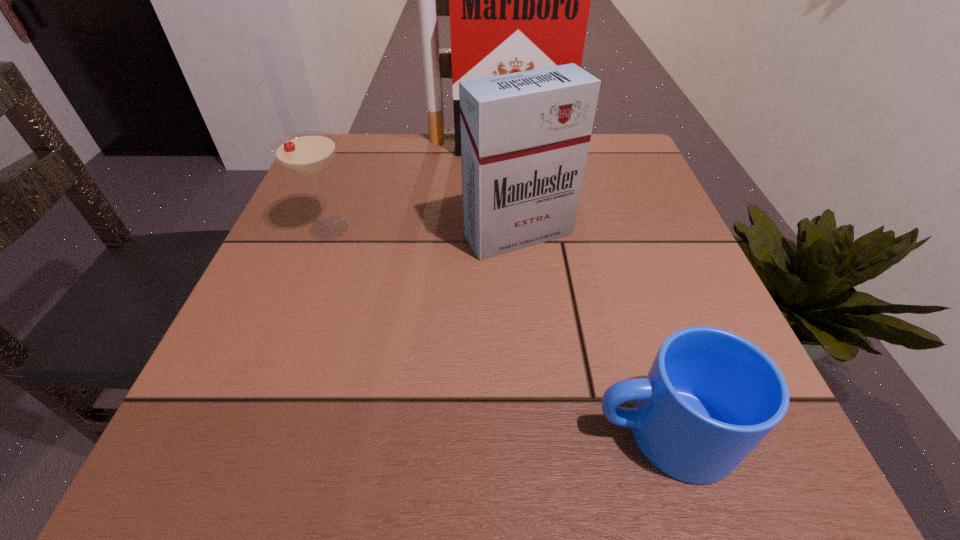
You are a GUI agent. You are given a task and a screenshot of the screen. Output one action in this format:
    pyautogui.click(x=<x>, y=<y>)
    Task: Click on the blank space at the near edge
    The image size is (960, 540).
    Given the screenshot: What is the action you would take?
    pyautogui.click(x=364, y=484)

The image size is (960, 540). Identify the location of vacant region at the left edge of the desktop. (279, 284).

This screenshot has width=960, height=540. I want to click on free space at the right edge of the desktop, so click(666, 225).

Where is `free space at the far left corner of the desktop`? free space at the far left corner of the desktop is located at coordinates (390, 156).

Locate an element on the screen. This screenshot has width=960, height=540. vacant space at the far right corner is located at coordinates (633, 146).

Where is `vacant area between the martini and the nearer cigarette case`? The width and height of the screenshot is (960, 540). vacant area between the martini and the nearer cigarette case is located at coordinates (423, 232).

The width and height of the screenshot is (960, 540). I want to click on vacant area that lies between the second shortest object and the nearest object, so click(x=496, y=330).

In order to click on empty space that is in between the mug and the martini in this screenshot , I will do `click(496, 330)`.

Where is `vacant space that is in between the leftmost object and the nearest object`? This screenshot has height=540, width=960. vacant space that is in between the leftmost object and the nearest object is located at coordinates (496, 330).

The height and width of the screenshot is (540, 960). I want to click on free point between the tallest object and the mug, so coord(580,289).